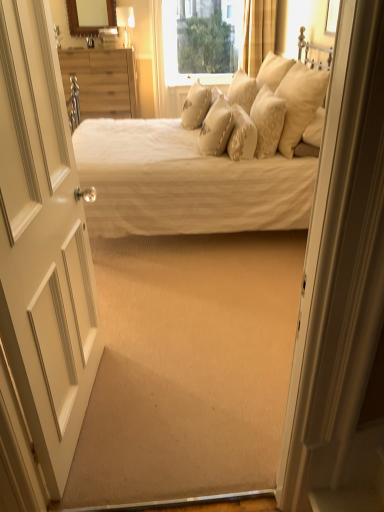
How much space does creamy satin pillows at upper center, which appears as the second pillow when viewed from the right, occupy horizontally?

The width of creamy satin pillows at upper center, which appears as the second pillow when viewed from the right, is 8.10 inches.

What do you see at coordinates (267, 121) in the screenshot?
I see `creamy satin pillows at upper center, which is the 5th pillow from left to right` at bounding box center [267, 121].

The image size is (384, 512). Describe the element at coordinates (90, 16) in the screenshot. I see `wooden framed mirror at upper center` at that location.

Describe the element at coordinates (258, 33) in the screenshot. I see `yellow textured curtain at upper center` at that location.

Locate an element on the screen. Image resolution: width=384 pixels, height=512 pixels. yellow textured curtain at upper center is located at coordinates (258, 33).

Measure the distance between matte gold lampshade at upper center and camera.

matte gold lampshade at upper center is 15.73 feet from camera.

What is the approximate width of wooden dresser at left?

19.99 inches.

Find the location of `white textured bed at center`. white textured bed at center is located at coordinates click(208, 165).

Considering the sizes of creamy satin pillows at upper center, which is the 5th pillow from left to right, and beige textured pillow at center, placed as the 5th pillow when sorted from right to left, in the image, is creamy satin pillows at upper center, which is the 5th pillow from left to right, wider or thinner than beige textured pillow at center, placed as the 5th pillow when sorted from right to left,?

creamy satin pillows at upper center, which is the 5th pillow from left to right, is thinner than beige textured pillow at center, placed as the 5th pillow when sorted from right to left.

Does creamy satin pillows at upper center, which appears as the second pillow when viewed from the right, appear on the left side of beige textured pillow at center, placed as the 5th pillow when sorted from right to left?

In fact, creamy satin pillows at upper center, which appears as the second pillow when viewed from the right, is to the right of beige textured pillow at center, placed as the 5th pillow when sorted from right to left.

Identify the location of the 3rd pillow counting from the right side of the beige textured pillow at center, placed as the 5th pillow when sorted from right to left. (267, 121).

From a real-world perspective, which is physically above, creamy satin pillows at upper center, which appears as the second pillow when viewed from the right, or beige textured pillow at center, placed as the 5th pillow when sorted from right to left?

creamy satin pillows at upper center, which appears as the second pillow when viewed from the right.

From a real-world perspective, who is located higher, creamy satin pillows at upper center, which appears as the second pillow when viewed from the right, or soft beige pillow at upper right, which ranks as the 6th pillow in left-to-right order?

From a 3D spatial view, soft beige pillow at upper right, which ranks as the 6th pillow in left-to-right order, is above.

Considering the relative positions of creamy satin pillows at upper center, which is the 5th pillow from left to right, and soft beige pillow at upper right, marked as the first pillow in a right-to-left arrangement, in the image provided, is creamy satin pillows at upper center, which is the 5th pillow from left to right, to the right of soft beige pillow at upper right, marked as the first pillow in a right-to-left arrangement, from the viewer's perspective?

No.

From the image's perspective, is creamy satin pillows at upper center, which is the 5th pillow from left to right, above soft beige pillow at upper right, marked as the first pillow in a right-to-left arrangement?

No, from the image's perspective, creamy satin pillows at upper center, which is the 5th pillow from left to right, is not on top of soft beige pillow at upper right, marked as the first pillow in a right-to-left arrangement.

Does white textured bed at center have a larger size compared to matte gold lampshade at upper center?

Yes, white textured bed at center is bigger than matte gold lampshade at upper center.

Does white textured bed at center have a lesser height compared to matte gold lampshade at upper center?

In fact, white textured bed at center may be taller than matte gold lampshade at upper center.

Considering the positions of points (166, 202) and (127, 39), is point (166, 202) farther from camera compared to point (127, 39)?

No.

This screenshot has width=384, height=512. In order to click on nightstand that appears above the creamy beige fabric pillow at center, which is the 3th pillow from left to right (from the image's perspective) in this screenshot , I will do `click(101, 81)`.

Which object is further away from the camera, wooden dresser at left or creamy beige fabric pillow at center, which is the 3th pillow from left to right?

wooden dresser at left is further from the camera.

Considering the relative sizes of wooden dresser at left and creamy beige fabric pillow at center, arranged as the 4th pillow when viewed from the right, in the image provided, is wooden dresser at left taller than creamy beige fabric pillow at center, arranged as the 4th pillow when viewed from the right,?

Yes, wooden dresser at left is taller than creamy beige fabric pillow at center, arranged as the 4th pillow when viewed from the right.

Is wooden dresser at left bigger or smaller than creamy beige fabric pillow at center, arranged as the 4th pillow when viewed from the right?

wooden dresser at left is bigger than creamy beige fabric pillow at center, arranged as the 4th pillow when viewed from the right.

Which is more to the right, fluffy beige pillow at upper center, which is the fourth pillow from left to right, or clear glass window at upper center?

fluffy beige pillow at upper center, which is the fourth pillow from left to right.

Considering the relative sizes of fluffy beige pillow at upper center, acting as the third pillow starting from the right, and clear glass window at upper center in the image provided, is fluffy beige pillow at upper center, acting as the third pillow starting from the right, smaller than clear glass window at upper center?

Yes, fluffy beige pillow at upper center, acting as the third pillow starting from the right, is smaller than clear glass window at upper center.

Is fluffy beige pillow at upper center, acting as the third pillow starting from the right, with clear glass window at upper center?

They are not placed beside each other.

Is fluffy beige pillow at upper center, acting as the third pillow starting from the right, facing towards clear glass window at upper center?

No, fluffy beige pillow at upper center, acting as the third pillow starting from the right, is not turned towards clear glass window at upper center.

Locate an element on the screen. This screenshot has height=512, width=384. door below the wooden framed mirror at upper center (from a real-world perspective) is located at coordinates (43, 244).

Which is closer to the camera, (9, 50) or (113, 6)?

Point (9, 50).

Considering the sizes of objects white wood door at left and wooden framed mirror at upper center in the image provided, who is taller, white wood door at left or wooden framed mirror at upper center?

white wood door at left.

Is point (244, 31) positioned before point (291, 68)?

That is False.

From a real-world perspective, which is physically above, yellow textured curtain at upper center or soft beige pillow at upper right, marked as the first pillow in a right-to-left arrangement?

In real-world perspective, yellow textured curtain at upper center is above.

Is yellow textured curtain at upper center behind soft beige pillow at upper right, marked as the first pillow in a right-to-left arrangement?

Yes.

From the picture: Is yellow textured curtain at upper center facing away from soft beige pillow at upper right, marked as the first pillow in a right-to-left arrangement?

No, yellow textured curtain at upper center is not facing away from soft beige pillow at upper right, marked as the first pillow in a right-to-left arrangement.

From the creamy satin pillows at upper center, which is the 5th pillow from left to right, count 1st pillows backward and point to it. Please provide its 2D coordinates.

[(216, 128)]

From the image's perspective, starting from the creamy satin pillows at upper center, which is the 5th pillow from left to right, which pillow is the 1st one above? Please provide its 2D coordinates.

[(300, 102)]

Considering their positions, is soft beige pillow at upper right, marked as the first pillow in a right-to-left arrangement, positioned further to creamy satin pillows at upper center, which is the 5th pillow from left to right, than white textured bed at center?

Among the two, white textured bed at center is located further to creamy satin pillows at upper center, which is the 5th pillow from left to right.

Estimate the real-world distances between objects in this image. Which object is further from wooden framed mirror at upper center, wooden dresser at left or matte gold lampshade at upper center?

Based on the image, wooden dresser at left appears to be further to wooden framed mirror at upper center.

Based on their spatial positions, is yellow textured curtain at upper center or fluffy beige pillow at upper center, which is the fourth pillow from left to right, closer to matte gold lampshade at upper center?

Based on the image, yellow textured curtain at upper center appears to be nearer to matte gold lampshade at upper center.

Looking at the image, which one is located closer to yellow textured curtain at upper center, creamy beige fabric pillow at center, arranged as the 4th pillow when viewed from the right, or wooden framed mirror at upper center?

wooden framed mirror at upper center.

Based on their spatial positions, is soft beige pillow at upper right, which ranks as the 6th pillow in left-to-right order, or beige textured pillow at center, placed as the 5th pillow when sorted from right to left, further from white wood door at left?

soft beige pillow at upper right, which ranks as the 6th pillow in left-to-right order, is positioned further to the anchor white wood door at left.

Looking at this image, from the image, which object appears to be farther from creamy satin pillows at upper center, which is the 5th pillow from left to right, yellow textured curtain at upper center or wooden framed mirror at upper center?

wooden framed mirror at upper center.

Consider the image. Which object lies nearer to the anchor point creamy satin pillows at upper center, which appears as the second pillow when viewed from the right, wooden dresser at left or wooden framed mirror at upper center?

wooden dresser at left lies closer to creamy satin pillows at upper center, which appears as the second pillow when viewed from the right, than the other object.

When comparing their distances from creamy beige fabric pillow at center, which is the 3th pillow from left to right, does yellow textured curtain at upper center or clear glass window at upper center seem further?

clear glass window at upper center lies further to creamy beige fabric pillow at center, which is the 3th pillow from left to right, than the other object.

Where is `pillow between wooden dresser at left and clear glass window at upper center from left to right`? This screenshot has width=384, height=512. pillow between wooden dresser at left and clear glass window at upper center from left to right is located at coordinates (196, 105).

Identify the location of lamp between creamy satin pillows at upper center, which appears as the second pillow when viewed from the right, and clear glass window at upper center from front to back. (125, 22).

The height and width of the screenshot is (512, 384). In order to click on lamp positioned between white textured bed at center and wooden framed mirror at upper center from near to far in this screenshot , I will do `click(125, 22)`.

Where is `pillow located between beige textured pillow at center, placed as the 5th pillow when sorted from right to left, and creamy satin pillow at upper center, which ranks as the 1th pillow in left-to-right order, in the depth direction`? This screenshot has height=512, width=384. pillow located between beige textured pillow at center, placed as the 5th pillow when sorted from right to left, and creamy satin pillow at upper center, which ranks as the 1th pillow in left-to-right order, in the depth direction is located at coordinates (242, 90).